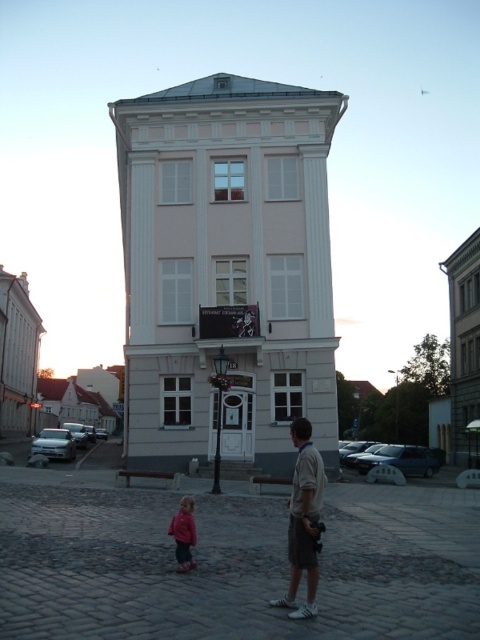
Is white smooth building at center above light brown cotton shirt at center?

Indeed, white smooth building at center is positioned over light brown cotton shirt at center.

Does white smooth building at center appear on the left side of light brown cotton shirt at center?

Correct, you'll find white smooth building at center to the left of light brown cotton shirt at center.

Where is `white smooth building at center`? white smooth building at center is located at coordinates (227, 268).

Between point (297, 500) and point (184, 547), which one is positioned in front?

Point (297, 500)

Is point (300, 508) positioned after point (188, 509)?

No, (300, 508) is closer to viewer.

Where is `light brown cotton shirt at center`? The height and width of the screenshot is (640, 480). light brown cotton shirt at center is located at coordinates (303, 520).

Between white smooth building at center and pink fleece jacket at lower center, which one is positioned higher?

white smooth building at center is above.

Does white smooth building at center appear on the left side of pink fleece jacket at lower center?

Indeed, white smooth building at center is positioned on the left side of pink fleece jacket at lower center.

Between point (126, 352) and point (183, 570), which one is positioned in front?

Point (183, 570)

At what (x,y) coordinates should I click in order to perform the action: click on white smooth building at center. Please return your answer as a coordinate pair (x, y). This screenshot has width=480, height=640. Looking at the image, I should click on (227, 268).